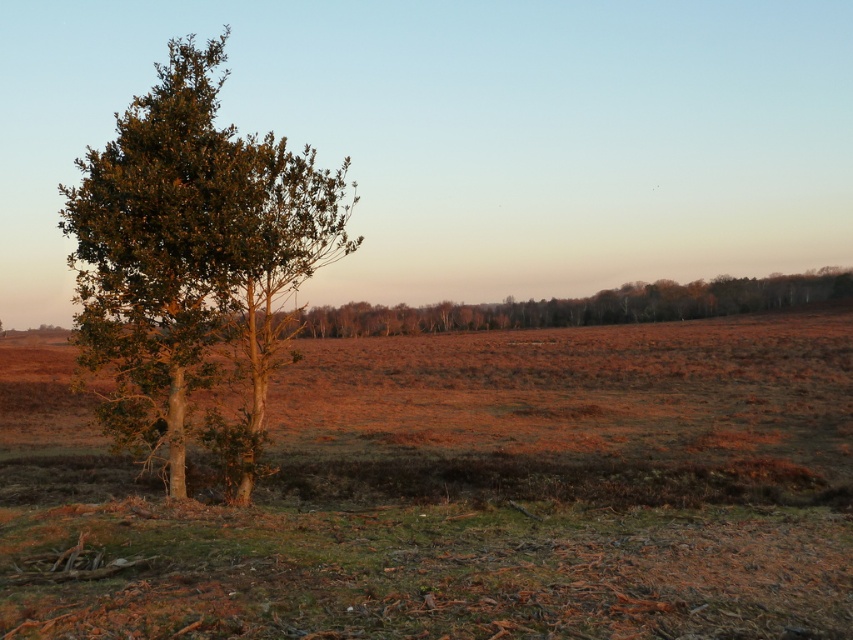
You are standing at the point marked by the coordinates point (463, 492). What do you see around you?

You are standing on brown grass at left marked by point (463, 492).

You are a farmer checking the field in the morning. You notice the brown grass at left and the green leafy tree at left. Which one is taller?

The green leafy tree at left is taller than the brown grass at left.